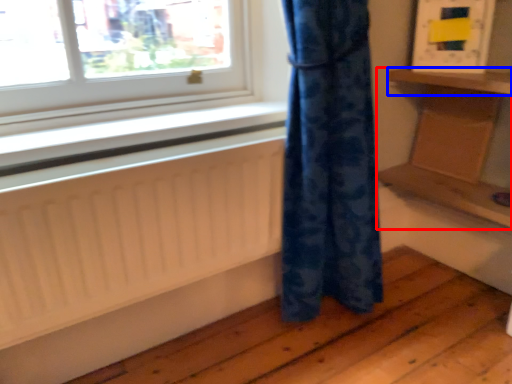
Question: Which point is closer to the camera, furniture (highlighted by a red box) or shelf (highlighted by a blue box)?

Choices:
 (A) furniture
 (B) shelf

Answer: (B)